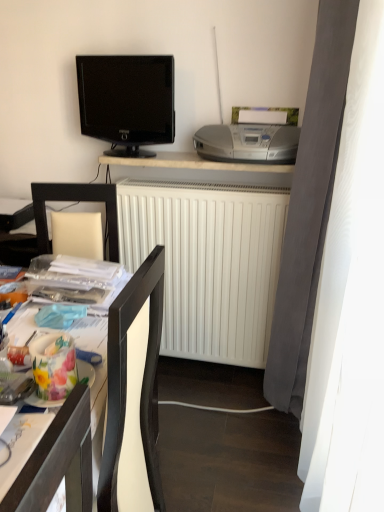
Question: Considering the relative sizes of white matte radiator at center and silver metallic stereo at upper right in the image provided, is white matte radiator at center wider than silver metallic stereo at upper right?

Choices:
 (A) yes
 (B) no

Answer: (B)

Question: Can you confirm if white matte radiator at center is bigger than silver metallic stereo at upper right?

Choices:
 (A) no
 (B) yes

Answer: (B)

Question: Considering the relative sizes of white matte radiator at center and silver metallic stereo at upper right in the image provided, is white matte radiator at center smaller than silver metallic stereo at upper right?

Choices:
 (A) yes
 (B) no

Answer: (B)

Question: Are white matte radiator at center and silver metallic stereo at upper right far apart?

Choices:
 (A) no
 (B) yes

Answer: (A)

Question: From a real-world perspective, is white matte radiator at center physically below silver metallic stereo at upper right?

Choices:
 (A) no
 (B) yes

Answer: (B)

Question: In terms of height, does black glossy tv at upper left look taller or shorter compared to silver metallic stereo at upper right?

Choices:
 (A) tall
 (B) short

Answer: (A)

Question: Considering the positions of point (87, 89) and point (244, 123), is point (87, 89) closer or farther from the camera than point (244, 123)?

Choices:
 (A) farther
 (B) closer

Answer: (A)

Question: In the image, is black glossy tv at upper left positioned in front of or behind silver metallic stereo at upper right?

Choices:
 (A) front
 (B) behind

Answer: (B)

Question: From a real-world perspective, is black glossy tv at upper left physically located above or below silver metallic stereo at upper right?

Choices:
 (A) above
 (B) below

Answer: (A)

Question: Is silver metallic stereo at upper right situated inside black glossy tv at upper left or outside?

Choices:
 (A) inside
 (B) outside

Answer: (B)

Question: Is silver metallic stereo at upper right wider or thinner than black glossy tv at upper left?

Choices:
 (A) wide
 (B) thin

Answer: (A)

Question: Considering the relative positions of silver metallic stereo at upper right and black glossy tv at upper left in the image provided, is silver metallic stereo at upper right to the left or to the right of black glossy tv at upper left?

Choices:
 (A) right
 (B) left

Answer: (A)

Question: Is silver metallic stereo at upper right bigger or smaller than black glossy tv at upper left?

Choices:
 (A) big
 (B) small

Answer: (B)

Question: Considering the positions of white matte desk at upper center, the 1th desk positioned from the back, and wooden desk at lower left, the 1th desk viewed from the front, in the image, is white matte desk at upper center, the 1th desk positioned from the back, wider or thinner than wooden desk at lower left, the 1th desk viewed from the front,?

Choices:
 (A) wide
 (B) thin

Answer: (B)

Question: Is point (177, 163) positioned closer to the camera than point (14, 494)?

Choices:
 (A) closer
 (B) farther

Answer: (B)